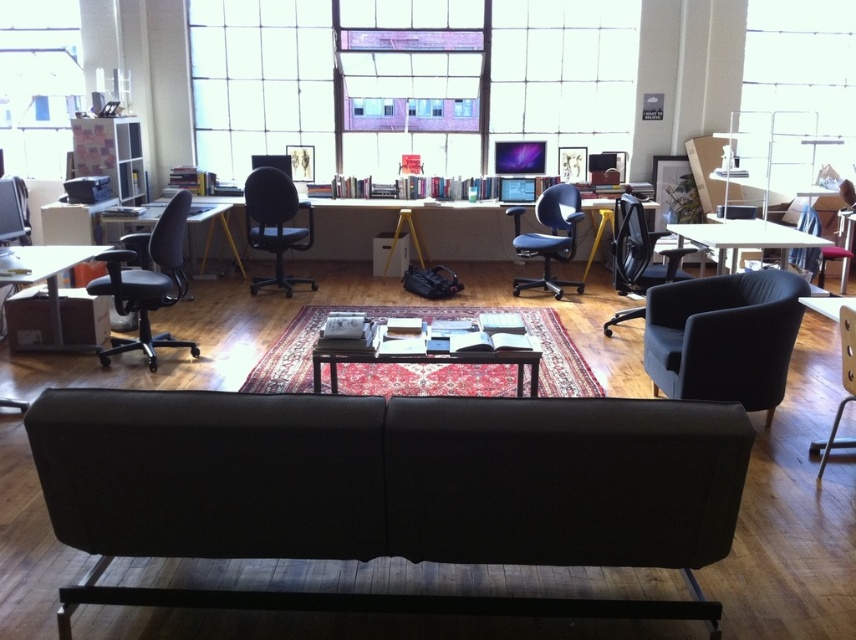
You are standing at the entrance of the office and want to walk to the point marked as point [613,406]. There is an obstacle at point [294,212]. Will you encounter the obstacle on your way?

Point [613,406] is in front of point [294,212], so you will encounter the obstacle at point [294,212] before reaching your destination.